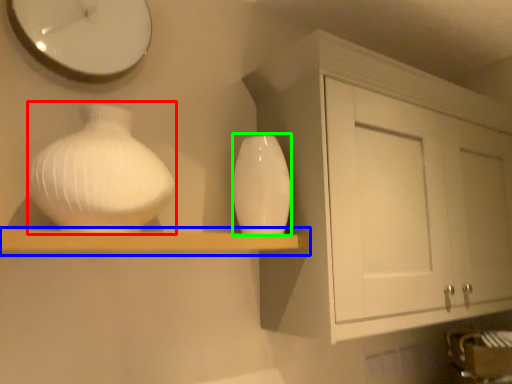
Question: Estimate the real-world distances between objects in this image. Which object is farther from vase (highlighted by a red box), shelf (highlighted by a blue box) or vase (highlighted by a green box)?

Choices:
 (A) shelf
 (B) vase

Answer: (B)